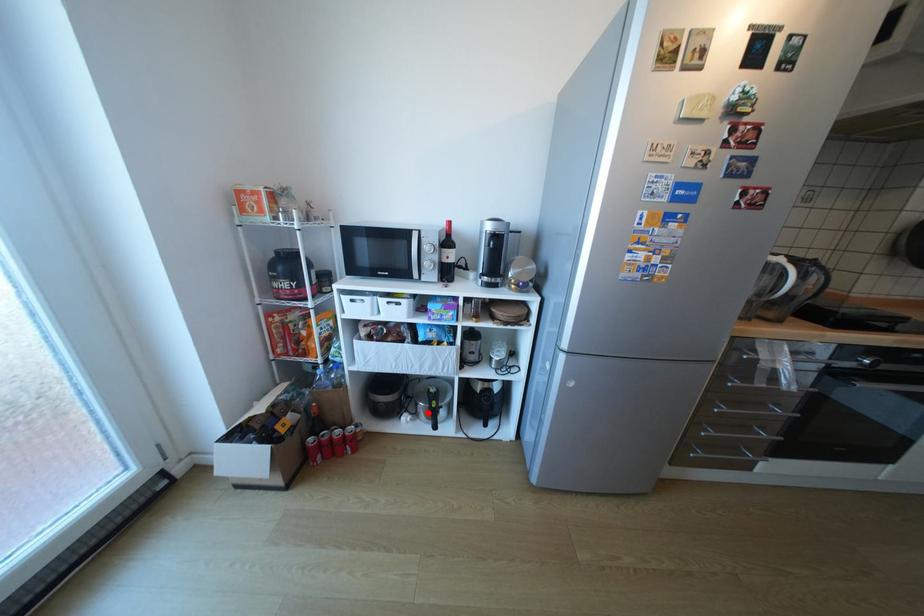
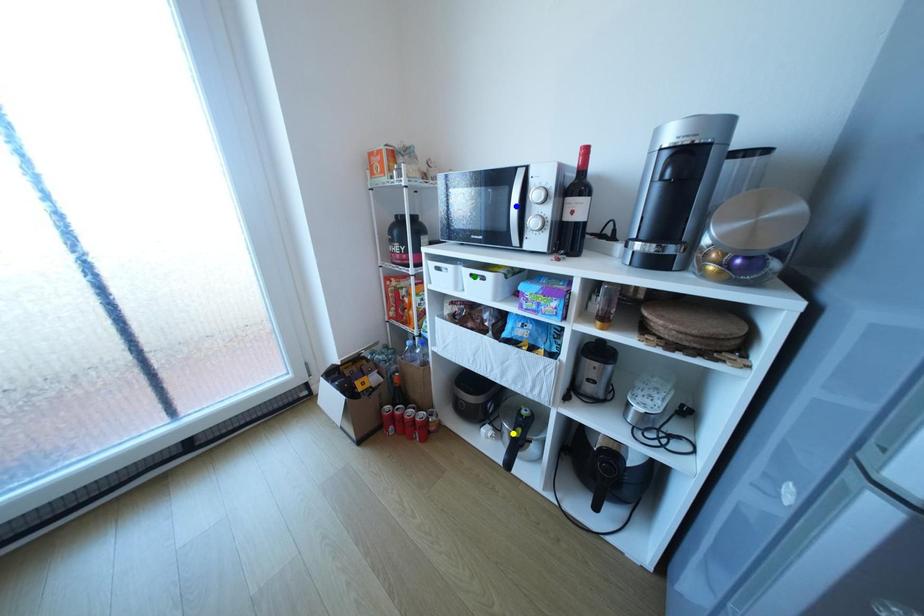
Question: I am providing you with two images of the same scene from different viewpoints. A red point is marked on the first image. You are given multiple points on the second image. In image 2, which mark is for the same physical point as the one in image 1?

Choices:
 (A) blue point
 (B) green point
 (C) yellow point

Answer: (C)